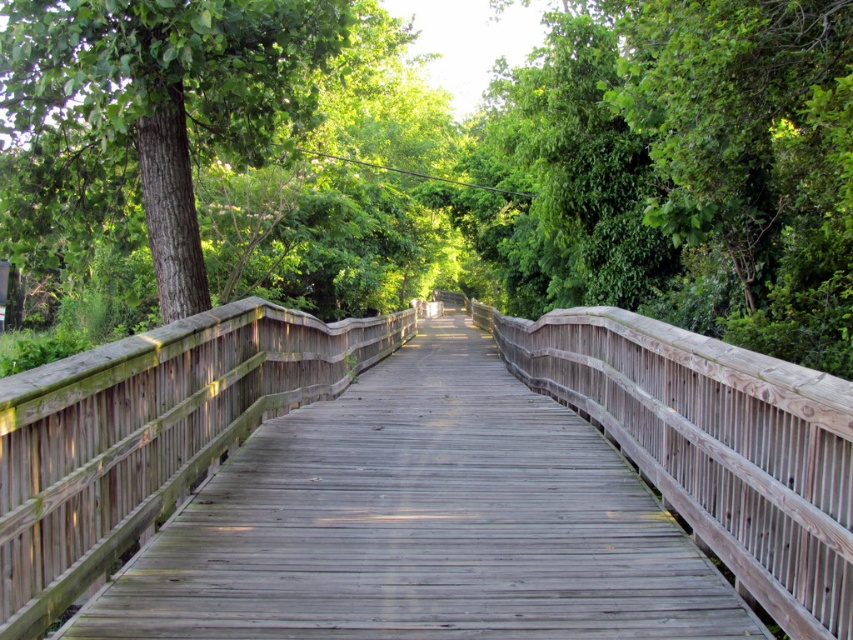
Question: Which point is closer to the camera taking this photo?

Choices:
 (A) (550, 84)
 (B) (68, 461)
 (C) (51, 93)

Answer: (B)

Question: Is weathered wood bridge at center bigger than green rough bark tree at left?

Choices:
 (A) yes
 (B) no

Answer: (A)

Question: Which point is closer to the camera taking this photo?

Choices:
 (A) (199, 77)
 (B) (260, 275)

Answer: (A)

Question: Does green leafy tree at center appear over green rough bark tree at left?

Choices:
 (A) yes
 (B) no

Answer: (A)

Question: Can you confirm if green leafy tree at center is bigger than weathered wood bridge at center?

Choices:
 (A) yes
 (B) no

Answer: (A)

Question: Which point appears closest to the camera in this image?

Choices:
 (A) (187, 93)
 (B) (834, 520)
 (C) (527, 205)

Answer: (B)